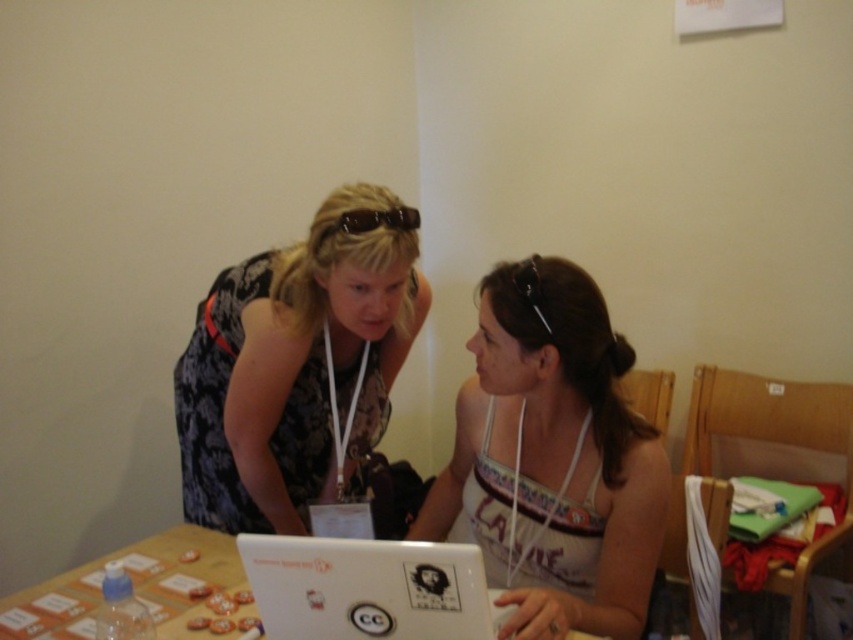
Is white fabric tank top at center wider than white glossy laptop at center?

Yes, white fabric tank top at center is wider than white glossy laptop at center.

Is white fabric tank top at center in front of white glossy laptop at center?

No, it is behind white glossy laptop at center.

Is point (610, 385) less distant than point (393, 618)?

No, (610, 385) is behind (393, 618).

You are a GUI agent. You are given a task and a screenshot of the screen. Output one action in this format:
    pyautogui.click(x=<x>, y=<y>)
    Task: Click on the white fabric tank top at center
    This screenshot has height=640, width=853.
    Given the screenshot: What is the action you would take?
    pyautogui.click(x=552, y=458)

Does floral dress at center lie behind white glossy laptop at center?

That is True.

Does floral dress at center have a greater width compared to white glossy laptop at center?

Indeed, floral dress at center has a greater width compared to white glossy laptop at center.

The height and width of the screenshot is (640, 853). I want to click on floral dress at center, so click(x=294, y=369).

Can you confirm if white plastic table at center is shorter than brown matte goggles at upper center?

Incorrect, white plastic table at center's height does not fall short of brown matte goggles at upper center's.

Who is taller, white plastic table at center or brown matte goggles at upper center?

With more height is white plastic table at center.

Locate an element on the screen. white plastic table at center is located at coordinates (137, 589).